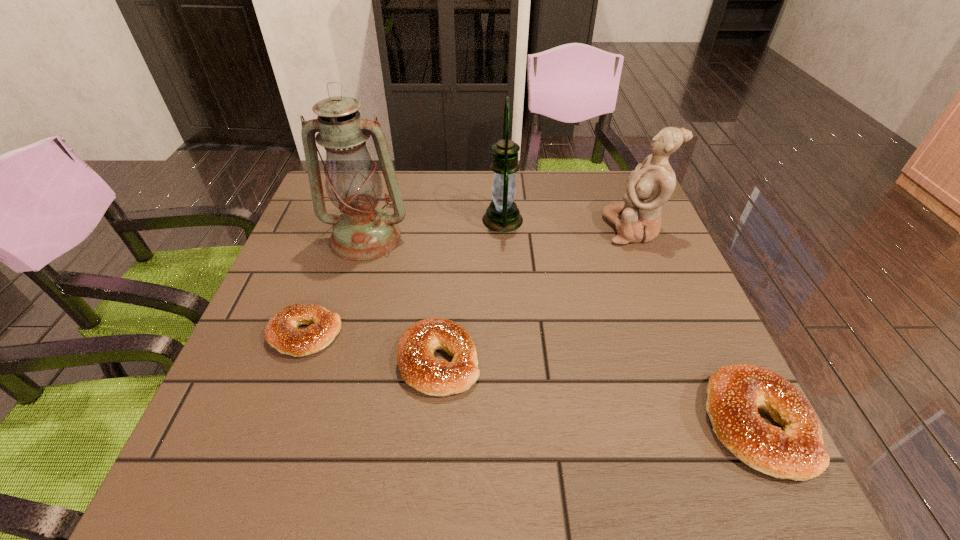
Locate an element on the screen. the shortest object is located at coordinates (281, 332).

Identify the location of the shortest bagel. (281, 332).

Image resolution: width=960 pixels, height=540 pixels. I want to click on the second shortest object, so click(419, 368).

Where is `the second tallest bagel`? This screenshot has height=540, width=960. the second tallest bagel is located at coordinates (419, 368).

Find the location of a particular element. The width and height of the screenshot is (960, 540). the rightmost bagel is located at coordinates (735, 392).

Find the location of a particular element. This screenshot has height=540, width=960. lantern is located at coordinates click(502, 215).

Image resolution: width=960 pixels, height=540 pixels. Find the location of `the second tallest object`. the second tallest object is located at coordinates (502, 215).

Where is `oil lamp`? oil lamp is located at coordinates (363, 231).

Find the location of `figurine`. figurine is located at coordinates (652, 183).

Find the location of a particular element. This screenshot has height=540, width=960. free region located on the back of the shortest bagel is located at coordinates (351, 207).